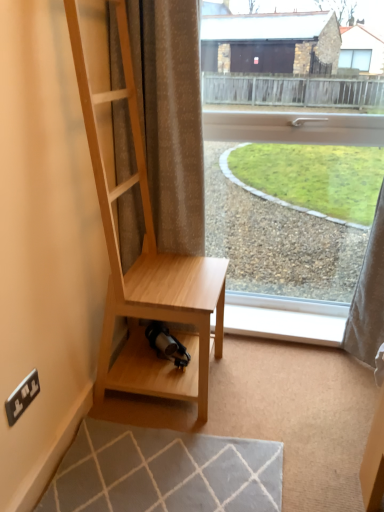
What do you see at coordinates (171, 117) in the screenshot? I see `beige textured curtain at center` at bounding box center [171, 117].

At what (x,y) coordinates should I click in order to perform the action: click on white plastic electric outlet at lower left. Please return your answer as a coordinate pair (x, y). Looking at the image, I should click on (22, 397).

From the image's perspective, relative to white plastic window sill at lower center, is beige textured curtain at center above or below?

beige textured curtain at center is above white plastic window sill at lower center.

Is beige textured curtain at center shorter than white plastic window sill at lower center?

No, beige textured curtain at center is not shorter than white plastic window sill at lower center.

From the picture: Between beige textured curtain at center and white plastic window sill at lower center, which one has smaller size?

white plastic window sill at lower center.

Considering the sizes of objects beige textured curtain at center and white plastic window sill at lower center in the image provided, who is wider, beige textured curtain at center or white plastic window sill at lower center?

white plastic window sill at lower center is wider.

Is beige textured curtain at center to the left or to the right of white plastic electric outlet at lower left in the image?

Clearly, beige textured curtain at center is on the right of white plastic electric outlet at lower left in the image.

Which of these two, beige textured curtain at center or white plastic electric outlet at lower left, is thinner?

white plastic electric outlet at lower left.

Is beige textured curtain at center bigger or smaller than white plastic electric outlet at lower left?

beige textured curtain at center is bigger than white plastic electric outlet at lower left.

Is transparent glass window at center inside the boundaries of beige textured curtain at center, or outside?

transparent glass window at center cannot be found inside beige textured curtain at center.

Could you tell me if transparent glass window at center is facing beige textured curtain at center?

Yes, transparent glass window at center is facing beige textured curtain at center.

Considering the relative sizes of transparent glass window at center and beige textured curtain at center in the image provided, is transparent glass window at center thinner than beige textured curtain at center?

Indeed, transparent glass window at center has a lesser width compared to beige textured curtain at center.

How far apart are light wood shelf at center and transparent glass window at center?

1.76 meters.

Could you tell me if light wood shelf at center is turned towards transparent glass window at center?

No, light wood shelf at center is not oriented towards transparent glass window at center.

Is light wood shelf at center touching transparent glass window at center?

No, light wood shelf at center is not with transparent glass window at center.

From the image's perspective, does light wood shelf at center appear higher than transparent glass window at center?

Incorrect, from the image's perspective, light wood shelf at center is lower than transparent glass window at center.

From a real-world perspective, is white plastic electric outlet at lower left positioned over beige textured curtain at center based on gravity?

No.

Considering the sizes of white plastic electric outlet at lower left and beige textured curtain at center in the image, is white plastic electric outlet at lower left taller or shorter than beige textured curtain at center?

In the image, white plastic electric outlet at lower left appears to be shorter than beige textured curtain at center.

Can you confirm if white plastic electric outlet at lower left is thinner than beige textured curtain at center?

Indeed, white plastic electric outlet at lower left has a lesser width compared to beige textured curtain at center.

Is beige textured curtain at center with transparent glass window at center?

beige textured curtain at center and transparent glass window at center are clearly separated.

Considering the relative positions of beige textured curtain at center and transparent glass window at center in the image provided, is beige textured curtain at center behind transparent glass window at center?

No, it is in front of transparent glass window at center.

Locate an element on the screen. Image resolution: width=384 pixels, height=512 pixels. window that is on the right side of beige textured curtain at center is located at coordinates (277, 246).

From a real-world perspective, is beige textured curtain at center on top of transparent glass window at center?

Indeed, from a real-world perspective, beige textured curtain at center stands above transparent glass window at center.

Consider the image. Is white plastic electric outlet at lower left behind transparent glass window at center?

No, white plastic electric outlet at lower left is closer to the camera.

Could you tell me if white plastic electric outlet at lower left is facing transparent glass window at center?

No, white plastic electric outlet at lower left is not facing towards transparent glass window at center.

Could transparent glass window at center be considered to be inside white plastic electric outlet at lower left?

Definitely not — transparent glass window at center is not inside white plastic electric outlet at lower left.

Which is more to the left, white plastic electric outlet at lower left or transparent glass window at center?

white plastic electric outlet at lower left.

Where is `curtain that appears on the left of white plastic window sill at lower center`? curtain that appears on the left of white plastic window sill at lower center is located at coordinates (171, 117).

You are a GUI agent. You are given a task and a screenshot of the screen. Output one action in this format:
    pyautogui.click(x=<x>, y=<y>)
    Task: Click on the curtain located above the white plastic electric outlet at lower left (from the image's perspective)
    This screenshot has width=384, height=512.
    Given the screenshot: What is the action you would take?
    pyautogui.click(x=171, y=117)

Based on the photo, which object lies further to the anchor point light wood shelf at center, beige textured curtain at center or white plastic window sill at lower center?

Based on the image, white plastic window sill at lower center appears to be further to light wood shelf at center.

When comparing their distances from light wood shelf at center, does transparent glass window at center or white plastic electric outlet at lower left seem closer?

white plastic electric outlet at lower left is positioned closer to the anchor light wood shelf at center.

Which object lies nearer to the anchor point white plastic electric outlet at lower left, light wood shelf at center or transparent glass window at center?

light wood shelf at center is closer to white plastic electric outlet at lower left.

Consider the image. Looking at the image, which one is located closer to light wood shelf at center, white plastic window sill at lower center or transparent glass window at center?

white plastic window sill at lower center lies closer to light wood shelf at center than the other object.

Considering their positions, is white plastic electric outlet at lower left positioned further to transparent glass window at center than beige textured curtain at center?

white plastic electric outlet at lower left is positioned further to the anchor transparent glass window at center.

Based on their spatial positions, is beige textured curtain at center or transparent glass window at center further from white plastic window sill at lower center?

Based on the image, transparent glass window at center appears to be further to white plastic window sill at lower center.

Looking at the image, which one is located further to transparent glass window at center, light wood shelf at center or white plastic window sill at lower center?

light wood shelf at center lies further to transparent glass window at center than the other object.

From the image, which object appears to be nearer to light wood shelf at center, white plastic window sill at lower center or white plastic electric outlet at lower left?

white plastic window sill at lower center is positioned closer to the anchor light wood shelf at center.

Where is `window between white plastic electric outlet at lower left and white plastic window sill at lower center from left to right`? window between white plastic electric outlet at lower left and white plastic window sill at lower center from left to right is located at coordinates (277, 246).

Where is `curtain between transparent glass window at center and white plastic window sill at lower center from top to bottom`? curtain between transparent glass window at center and white plastic window sill at lower center from top to bottom is located at coordinates (171, 117).

You are a GUI agent. You are given a task and a screenshot of the screen. Output one action in this format:
    pyautogui.click(x=<x>, y=<y>)
    Task: Click on the window between light wood shelf at center and white plastic window sill at lower center in the front-back direction
    The image size is (384, 512).
    Given the screenshot: What is the action you would take?
    pyautogui.click(x=277, y=246)

Where is `shelf between white plastic electric outlet at lower left and transparent glass window at center from left to right`? This screenshot has height=512, width=384. shelf between white plastic electric outlet at lower left and transparent glass window at center from left to right is located at coordinates (147, 267).